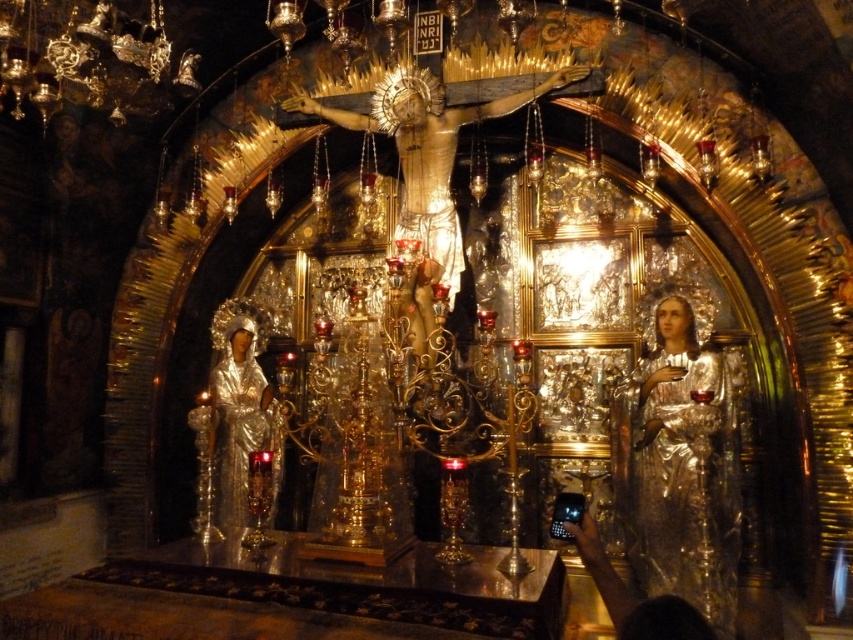
You are an interior designer planning to place a new decorative item between the shiny silver statue at right and the silver metallic statue at left. Based on their widths, which statue should you position closer to the center of the shrine to maintain symmetry?

The shiny silver statue at right might be wider than the silver metallic statue at left, so to maintain symmetry, you should position the wider shiny silver statue at right closer to the center to balance the visual weight.

You are an architect designing a new religious shrine. You want to place a golden crucifix and a silver statue in a symmetrical layout. Given the current arrangement, would the gold metallic crucifix at center and silver metallic statue at left align symmetrically if mirrored along the central axis?

The gold metallic crucifix at center is positioned on the right side of silver metallic statue at left, so mirroring this arrangement along the central axis would not create symmetry because the crucifix would then be on the left side of the statue, disrupting the balance.

You are a visitor standing at the entrance of the shrine. You want to take a photo of the gold metallic crucifix at center and the silver metallic statue at left. Which object should you focus on first to ensure both are in the frame without moving the camera?

You should focus on the gold metallic crucifix at center first because it is closer to you than the silver metallic statue at left, so keeping it in focus will also include the statue in the background.